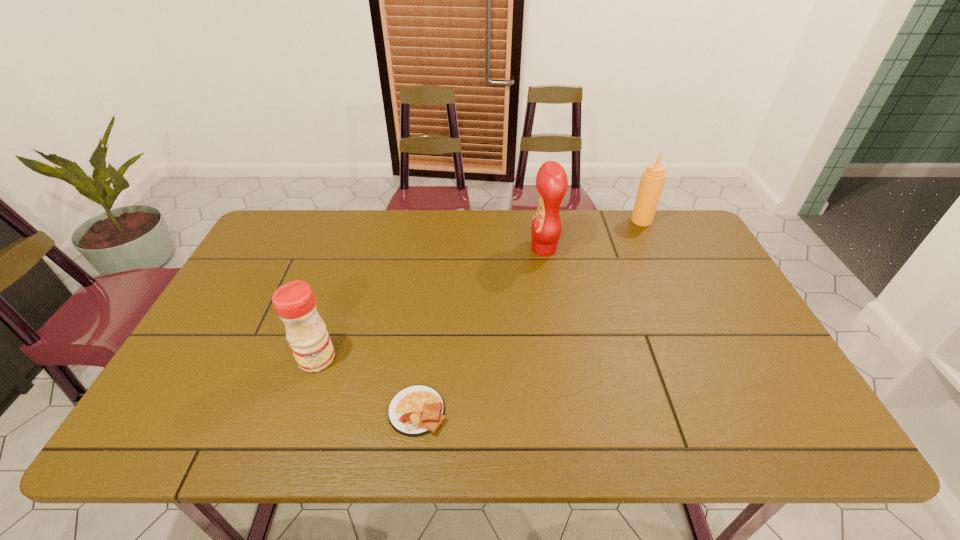
Identify the location of free area in between the rightmost object and the third nearest object. This screenshot has height=540, width=960. (592, 234).

Select which object appears as the third closest to the rightmost object. Please provide its 2D coordinates. Your answer should be formatted as a tuple, i.e. [(x, y)], where the tuple contains the x and y coordinates of a point satisfying the conditions above.

[(294, 302)]

Point out which object is positioned as the nearest to the second nearest object. Please provide its 2D coordinates. Your answer should be formatted as a tuple, i.e. [(x, y)], where the tuple contains the x and y coordinates of a point satisfying the conditions above.

[(417, 410)]

Locate an element on the screen. Image resolution: width=960 pixels, height=540 pixels. condiment that is the closest to the nearest object is located at coordinates (294, 302).

You are a GUI agent. You are given a task and a screenshot of the screen. Output one action in this format:
    pyautogui.click(x=<x>, y=<y>)
    Task: Click on the second closest condiment relative to the rightmost object
    
    Given the screenshot: What is the action you would take?
    pyautogui.click(x=294, y=302)